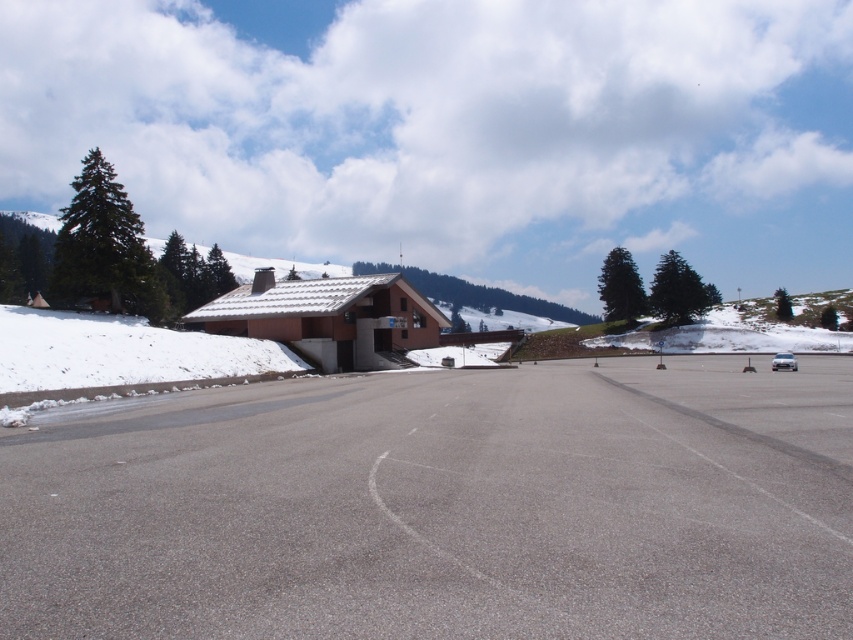
Question: Considering the relative positions of white snow at left and green matte pine at left in the image provided, where is white snow at left located with respect to green matte pine at left?

Choices:
 (A) above
 (B) below

Answer: (B)

Question: Does white snow at left appear under green matte pine at left?

Choices:
 (A) yes
 (B) no

Answer: (A)

Question: Which point is farther to the camera?

Choices:
 (A) green matte pine at left
 (B) white snow at left

Answer: (A)

Question: Can you confirm if white snow at left is positioned to the right of green matte pine at left?

Choices:
 (A) yes
 (B) no

Answer: (A)